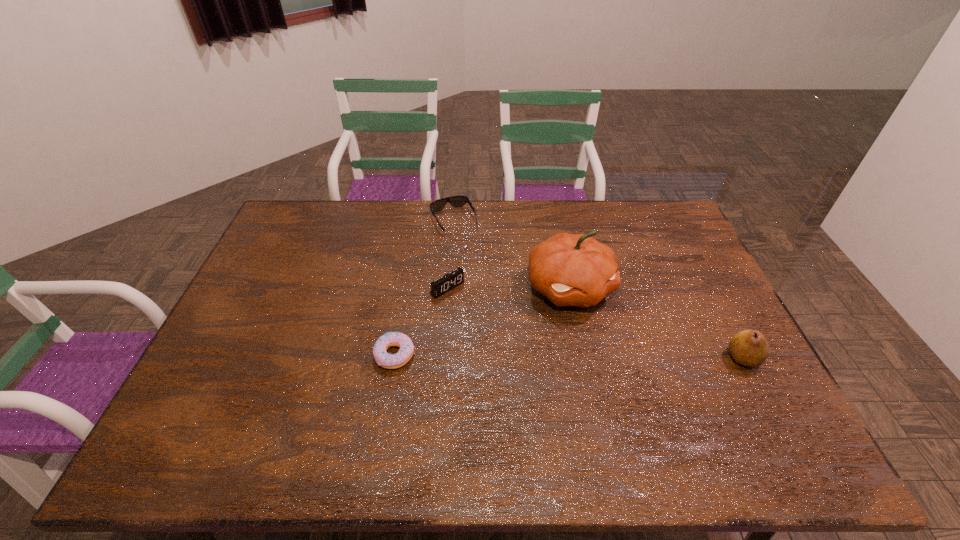
Locate an element on the screen. The image size is (960, 540). blank space at the far edge is located at coordinates (638, 237).

Find the location of a particular element. free location at the near edge of the desktop is located at coordinates (685, 420).

This screenshot has height=540, width=960. I want to click on vacant space at the left edge of the desktop, so click(206, 382).

You are a GUI agent. You are given a task and a screenshot of the screen. Output one action in this format:
    pyautogui.click(x=<x>, y=<y>)
    Task: Click on the free spot at the right edge of the desktop
    
    Given the screenshot: What is the action you would take?
    pyautogui.click(x=733, y=363)

This screenshot has height=540, width=960. Find the location of `free location at the far right corner of the desktop`. free location at the far right corner of the desktop is located at coordinates (652, 202).

What are the coordinates of `free space between the fourth shortest object and the alarm clock` in the screenshot? It's located at (595, 323).

Locate an element on the screen. Image resolution: width=960 pixels, height=540 pixels. vacant space that is in between the doughnut and the alarm clock is located at coordinates (421, 321).

Where is `free area in between the pear and the second object from right to left`? The height and width of the screenshot is (540, 960). free area in between the pear and the second object from right to left is located at coordinates (657, 322).

This screenshot has width=960, height=540. Identify the location of unoccupied area between the doughnut and the alarm clock. (421, 321).

Where is `free space between the alarm clock and the pear`? free space between the alarm clock and the pear is located at coordinates (595, 323).